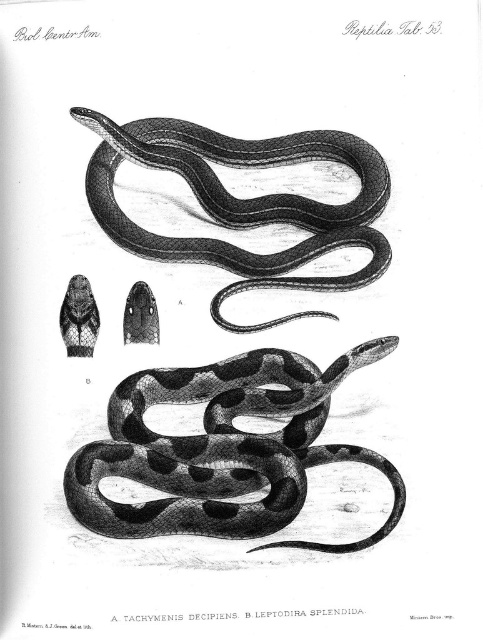
Question: Which point appears closest to the camera in this image?

Choices:
 (A) (107, 468)
 (B) (298, 200)

Answer: (A)

Question: Which point is closer to the camera?

Choices:
 (A) (341, 547)
 (B) (161, 136)

Answer: (A)

Question: Is black textured snake at center to the right of smooth black snake at center from the viewer's perspective?

Choices:
 (A) no
 (B) yes

Answer: (B)

Question: Does black textured snake at center appear on the right side of smooth black snake at center?

Choices:
 (A) yes
 (B) no

Answer: (A)

Question: Is black textured snake at center smaller than smooth black snake at center?

Choices:
 (A) yes
 (B) no

Answer: (B)